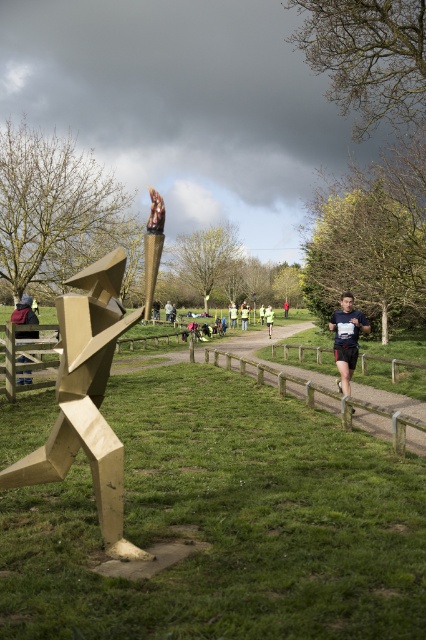
This screenshot has height=640, width=426. Identify the location of gold metallic sculpture at left. (86, 397).

Can you confirm if gold metallic sculpture at left is positioned below yellow fabric runner at center?

Yes.

Measure the distance between point (71, 300) and camera.

Point (71, 300) is 4.56 meters away from camera.

Image resolution: width=426 pixels, height=640 pixels. I want to click on gold metallic sculpture at left, so click(x=86, y=397).

Between point (163, 236) and point (230, 316), which one is positioned in front?

Point (163, 236)

Does point (154, 243) come farther from viewer compared to point (235, 307)?

No, it is not.

This screenshot has height=640, width=426. What do you see at coordinates (152, 248) in the screenshot?
I see `gold metallic torch at center` at bounding box center [152, 248].

At what (x,y) coordinates should I click in order to perform the action: click on gold metallic torch at center. Please return your answer as a coordinate pair (x, y). Looking at the image, I should click on (152, 248).

Which of these two, green reflective jacket at center or dark blue fabric runner at center, stands taller?

dark blue fabric runner at center is taller.

The width and height of the screenshot is (426, 640). What do you see at coordinates (268, 320) in the screenshot?
I see `green reflective jacket at center` at bounding box center [268, 320].

Does point (270, 324) lie in front of point (233, 321)?

Yes, point (270, 324) is in front of point (233, 321).

You are a GUI agent. You are given a task and a screenshot of the screen. Output one action in this format:
    pyautogui.click(x=<x>, y=<y>)
    Task: Click on the green reflective jacket at center
    This screenshot has width=426, height=640.
    Given the screenshot: What is the action you would take?
    pyautogui.click(x=268, y=320)